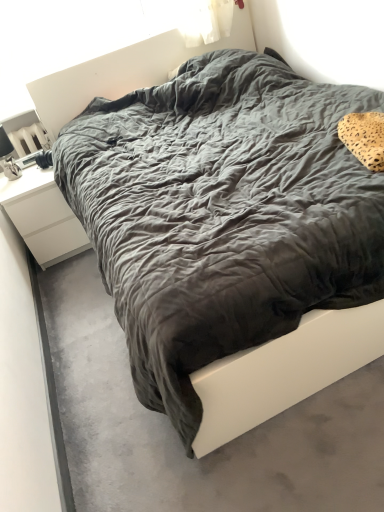
Locate an element on the screen. The image size is (384, 512). dark gray fabric bed at center is located at coordinates (178, 437).

Locate an element on the screen. Image resolution: width=384 pixels, height=512 pixels. leopard print fabric pillow at upper right is located at coordinates [x=364, y=138].

Locate an element on the screen. The width and height of the screenshot is (384, 512). dark gray fabric bed at center is located at coordinates (178, 437).

Is white matte nightstand at left taller or shorter than leopard print fabric pillow at upper right?

white matte nightstand at left is taller than leopard print fabric pillow at upper right.

How distant is white matte nightstand at left from leopard print fabric pillow at upper right?

white matte nightstand at left and leopard print fabric pillow at upper right are 1.76 meters apart from each other.

Is white matte nightstand at left in contact with leopard print fabric pillow at upper right?

white matte nightstand at left is not next to leopard print fabric pillow at upper right, and they're not touching.

Can you confirm if white matte nightstand at left is wider than leopard print fabric pillow at upper right?

Correct, the width of white matte nightstand at left exceeds that of leopard print fabric pillow at upper right.

From a real-world perspective, is leopard print fabric pillow at upper right located higher than dark gray fabric bed at center?

Indeed, from a real-world perspective, leopard print fabric pillow at upper right stands above dark gray fabric bed at center.

In terms of width, does leopard print fabric pillow at upper right look wider or thinner when compared to dark gray fabric bed at center?

leopard print fabric pillow at upper right is thinner than dark gray fabric bed at center.

Is dark gray fabric bed at center surrounded by leopard print fabric pillow at upper right?

Definitely not — dark gray fabric bed at center is not inside leopard print fabric pillow at upper right.

From the image's perspective, is leopard print fabric pillow at upper right located above or below dark gray fabric bed at center?

From the image's perspective, leopard print fabric pillow at upper right appears above dark gray fabric bed at center.

Would you say dark gray fabric bed at center is outside white matte nightstand at left?

Yes, dark gray fabric bed at center is not within white matte nightstand at left.

From the image's perspective, is dark gray fabric bed at center under white matte nightstand at left?

Correct, dark gray fabric bed at center appears lower than white matte nightstand at left in the image.

What's the angular difference between dark gray fabric bed at center and white matte nightstand at left's facing directions?

The facing directions of dark gray fabric bed at center and white matte nightstand at left are 0.0483 degrees apart.

Is dark gray fabric bed at center aimed at white matte nightstand at left?

No, dark gray fabric bed at center is not oriented towards white matte nightstand at left.

Which object is closer to the camera, white matte nightstand at left or dark gray fabric bed at center?

dark gray fabric bed at center.

Is there a large distance between white matte nightstand at left and dark gray fabric bed at center?

Answer: white matte nightstand at left is near dark gray fabric bed at center, not far away.

Considering the positions of objects white matte nightstand at left and dark gray fabric bed at center in the image provided, who is more to the left, white matte nightstand at left or dark gray fabric bed at center?

white matte nightstand at left is more to the left.

Is white matte nightstand at left situated inside dark gray fabric bed at center or outside?

white matte nightstand at left is outside dark gray fabric bed at center.

Which object is thinner, leopard print fabric pillow at upper right or white matte nightstand at left?

leopard print fabric pillow at upper right.

From the image's perspective, is leopard print fabric pillow at upper right beneath white matte nightstand at left?

No, from the image's perspective, leopard print fabric pillow at upper right is not beneath white matte nightstand at left.

Considering the sizes of objects leopard print fabric pillow at upper right and white matte nightstand at left in the image provided, who is smaller, leopard print fabric pillow at upper right or white matte nightstand at left?

leopard print fabric pillow at upper right is smaller.

In the scene shown: Considering the positions of objects dark gray fabric bed at center and leopard print fabric pillow at upper right in the image provided, who is more to the left, dark gray fabric bed at center or leopard print fabric pillow at upper right?

dark gray fabric bed at center is more to the left.

Based on the photo, which object is further away from the camera taking this photo, dark gray fabric bed at center or leopard print fabric pillow at upper right?

Positioned behind is leopard print fabric pillow at upper right.

Is dark gray fabric bed at center touching leopard print fabric pillow at upper right?

They are not placed beside each other.

Locate an element on the screen. nightstand below the leopard print fabric pillow at upper right (from a real-world perspective) is located at coordinates (42, 216).

Locate an element on the screen. concrete that appears below the leopard print fabric pillow at upper right (from the image's perspective) is located at coordinates (178, 437).

Estimate the real-world distances between objects in this image. Which object is further from dark gray fabric bed at center, leopard print fabric pillow at upper right or white matte nightstand at left?

leopard print fabric pillow at upper right.

Considering their positions, is dark gray fabric bed at center positioned further to white matte nightstand at left than leopard print fabric pillow at upper right?

The object further to white matte nightstand at left is leopard print fabric pillow at upper right.

Based on their spatial positions, is white matte nightstand at left or dark gray fabric bed at center closer to leopard print fabric pillow at upper right?

dark gray fabric bed at center lies closer to leopard print fabric pillow at upper right than the other object.

Which object lies nearer to the anchor point dark gray fabric bed at center, white matte nightstand at left or leopard print fabric pillow at upper right?

Based on the image, white matte nightstand at left appears to be nearer to dark gray fabric bed at center.

From the picture: Estimate the real-world distances between objects in this image. Which object is closer to leopard print fabric pillow at upper right, dark gray fabric bed at center or white matte nightstand at left?

The object closer to leopard print fabric pillow at upper right is dark gray fabric bed at center.

Estimate the real-world distances between objects in this image. Which object is further from white matte nightstand at left, leopard print fabric pillow at upper right or dark gray fabric bed at center?

leopard print fabric pillow at upper right is further to white matte nightstand at left.

The height and width of the screenshot is (512, 384). In order to click on concrete between white matte nightstand at left and leopard print fabric pillow at upper right in this screenshot , I will do `click(178, 437)`.